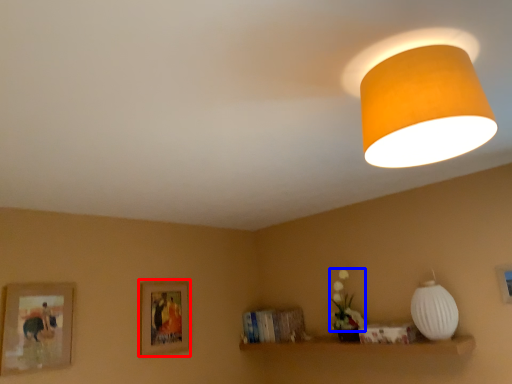
Question: Which object appears farthest to the camera in this image, picture frame (highlighted by a red box) or flower (highlighted by a blue box)?

Choices:
 (A) picture frame
 (B) flower

Answer: (A)